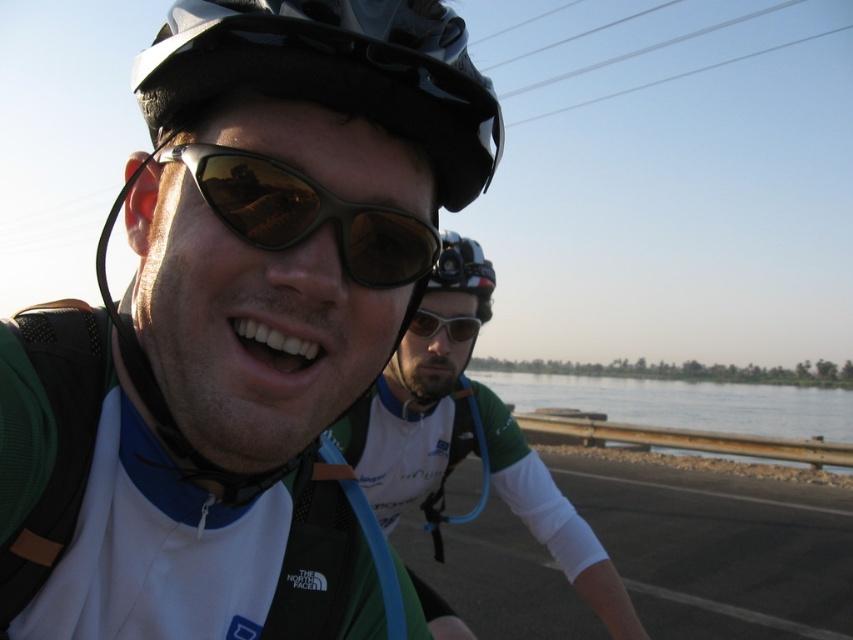
Question: From the image, what is the correct spatial relationship of matte green jersey at center in relation to black matte helmet at center?

Choices:
 (A) left
 (B) right

Answer: (B)

Question: Which point is farther to the camera?

Choices:
 (A) matte black helmet at upper center
 (B) clear water at river right
 (C) shiny brown plastic goggles at center
 (D) matte green jersey at center

Answer: (B)

Question: Does matte green jersey at center appear on the left side of clear water at river right?

Choices:
 (A) no
 (B) yes

Answer: (B)

Question: Does clear water at river right have a greater width compared to matte black goggles at center?

Choices:
 (A) no
 (B) yes

Answer: (B)

Question: Which of these objects is positioned closest to the matte black goggles at center?

Choices:
 (A) shiny brown plastic goggles at center
 (B) black matte helmet at center
 (C) matte green jersey at center

Answer: (B)

Question: Which of the following is the closest to the observer?

Choices:
 (A) (444, 621)
 (B) (264, 220)
 (C) (444, 365)

Answer: (B)